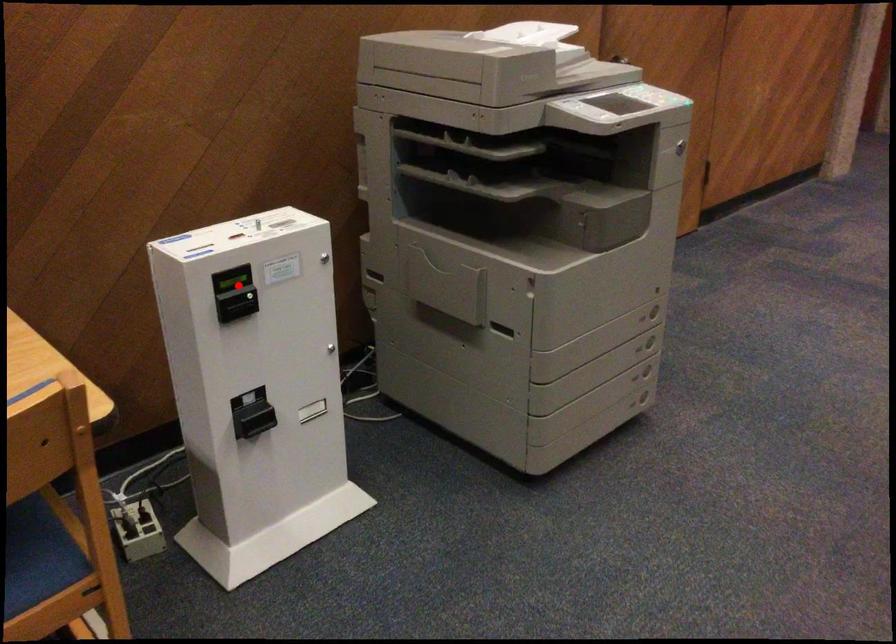
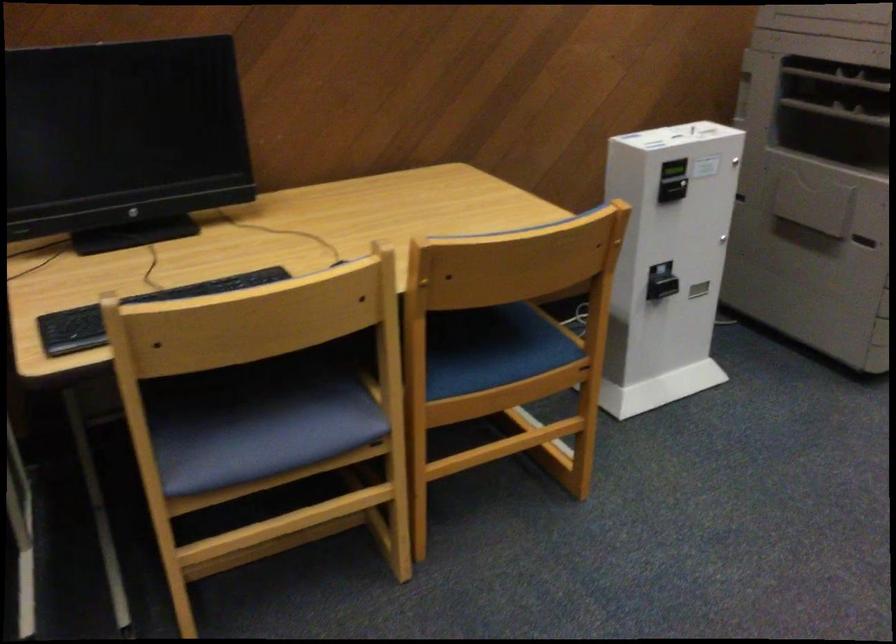
Question: I am providing you with two images of the same scene from different viewpoints. Given a red point in image1, look at the same physical point in image2. Is it:

Choices:
 (A) Closer to the viewpoint
 (B) Farther from the viewpoint

Answer: (B)